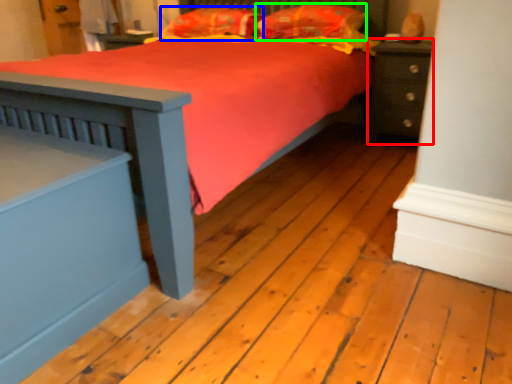
Question: Considering the real-world distances, which object is closest to nightstand (highlighted by a red box)? pillow (highlighted by a blue box) or pillow (highlighted by a green box).

Choices:
 (A) pillow
 (B) pillow

Answer: (B)